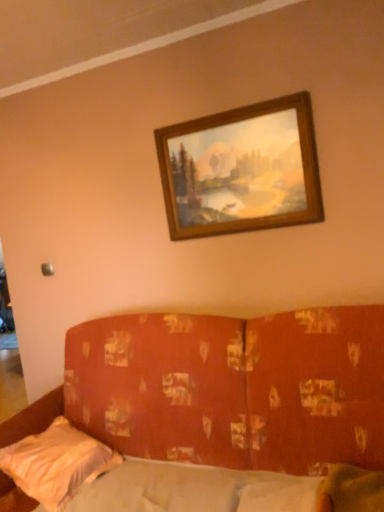
Describe the element at coordinates (56, 463) in the screenshot. I see `white satin pillow at lower left` at that location.

I want to click on white fabric mattress at lower center, so click(194, 490).

Where is `wooden frame at upper center`? wooden frame at upper center is located at coordinates (241, 169).

Locate an element on the screen. The width and height of the screenshot is (384, 512). white satin pillow at lower left is located at coordinates (56, 463).

You are a GUI agent. You are given a task and a screenshot of the screen. Output one action in this format:
    pyautogui.click(x=<x>, y=<y>)
    Task: Click on the studio couch above the white fabric mattress at lower center (from a real-world perspective)
    
    Given the screenshot: What is the action you would take?
    pyautogui.click(x=227, y=388)

Which object is thinner, white fabric mattress at lower center or textured orange fabric couch at center?

white fabric mattress at lower center.

Between white fabric mattress at lower center and textured orange fabric couch at center, which one has more height?

With more height is textured orange fabric couch at center.

Is white fabric mattress at lower center turned away from textured orange fabric couch at center?

Yes, white fabric mattress at lower center is positioned with its back facing textured orange fabric couch at center.

Based on their positions, is white fabric mattress at lower center located to the left or right of white satin pillow at lower left?

Based on their positions, white fabric mattress at lower center is located to the right of white satin pillow at lower left.

Which of these two, white fabric mattress at lower center or white satin pillow at lower left, stands shorter?

With less height is white fabric mattress at lower center.

How many degrees apart are the facing directions of white fabric mattress at lower center and white satin pillow at lower left?

There is a 5.73-degree angle between the facing directions of white fabric mattress at lower center and white satin pillow at lower left.

The width and height of the screenshot is (384, 512). I want to click on mattress on the right of white satin pillow at lower left, so click(194, 490).

Based on the photo, how many degrees apart are the facing directions of textured orange fabric couch at center and white fabric mattress at lower center?

textured orange fabric couch at center and white fabric mattress at lower center are facing 1.5 degrees away from each other.

Considering the sizes of objects textured orange fabric couch at center and white fabric mattress at lower center in the image provided, who is thinner, textured orange fabric couch at center or white fabric mattress at lower center?

Thinner between the two is white fabric mattress at lower center.

From the picture: Is textured orange fabric couch at center looking in the opposite direction of white fabric mattress at lower center?

Yes.

From the image's perspective, is textured orange fabric couch at center above or below white fabric mattress at lower center?

textured orange fabric couch at center is above white fabric mattress at lower center.

Which is in front, white satin pillow at lower left or textured orange fabric couch at center?

textured orange fabric couch at center.

Is white satin pillow at lower left not near textured orange fabric couch at center?

white satin pillow at lower left is actually quite close to textured orange fabric couch at center.

In the scene shown: Is white satin pillow at lower left oriented towards textured orange fabric couch at center?

Yes, white satin pillow at lower left is oriented towards textured orange fabric couch at center.

Looking at this image, who is smaller, textured orange fabric couch at center or wooden frame at upper center?

wooden frame at upper center.

Can you tell me how much textured orange fabric couch at center and wooden frame at upper center differ in facing direction?

0.00137 degrees.

Looking at this image, in the image, is textured orange fabric couch at center on the left side or the right side of wooden frame at upper center?

textured orange fabric couch at center is to the left of wooden frame at upper center.

Between textured orange fabric couch at center and wooden frame at upper center, which one has smaller width?

With smaller width is wooden frame at upper center.

Is wooden frame at upper center positioned beyond the bounds of white satin pillow at lower left?

wooden frame at upper center lies outside white satin pillow at lower left's area.

Identify the location of picture frame behind the white satin pillow at lower left. Image resolution: width=384 pixels, height=512 pixels. (241, 169).

Does wooden frame at upper center have a lesser height compared to white satin pillow at lower left?

No, wooden frame at upper center is not shorter than white satin pillow at lower left.

Looking at this image, is wooden frame at upper center smaller than white satin pillow at lower left?

Yes.

The width and height of the screenshot is (384, 512). I want to click on picture frame positioned vertically above the white fabric mattress at lower center (from a real-world perspective), so click(241, 169).

From the image's perspective, which one is positioned lower, white fabric mattress at lower center or wooden frame at upper center?

From the image's view, white fabric mattress at lower center is below.

Considering the relative sizes of white fabric mattress at lower center and wooden frame at upper center in the image provided, is white fabric mattress at lower center wider than wooden frame at upper center?

Yes, white fabric mattress at lower center is wider than wooden frame at upper center.

At what (x,y) coordinates should I click in order to perform the action: click on mattress below the textured orange fabric couch at center (from a real-world perspective). Please return your answer as a coordinate pair (x, y). Image resolution: width=384 pixels, height=512 pixels. Looking at the image, I should click on (194, 490).

Find the location of a particular element. This screenshot has height=512, width=384. mattress that is in front of the white satin pillow at lower left is located at coordinates (194, 490).

Which object lies further to the anchor point white fabric mattress at lower center, white satin pillow at lower left or textured orange fabric couch at center?

textured orange fabric couch at center is further to white fabric mattress at lower center.

Looking at the image, which one is located closer to white fabric mattress at lower center, wooden frame at upper center or textured orange fabric couch at center?

Based on the image, textured orange fabric couch at center appears to be nearer to white fabric mattress at lower center.

When comparing their distances from white fabric mattress at lower center, does wooden frame at upper center or white satin pillow at lower left seem further?

wooden frame at upper center is further to white fabric mattress at lower center.

Which object lies nearer to the anchor point textured orange fabric couch at center, wooden frame at upper center or white satin pillow at lower left?

white satin pillow at lower left lies closer to textured orange fabric couch at center than the other object.

Estimate the real-world distances between objects in this image. Which object is closer to white satin pillow at lower left, textured orange fabric couch at center or wooden frame at upper center?

textured orange fabric couch at center is closer to white satin pillow at lower left.

Estimate the real-world distances between objects in this image. Which object is further from white satin pillow at lower left, white fabric mattress at lower center or textured orange fabric couch at center?

textured orange fabric couch at center.

Which object lies further to the anchor point wooden frame at upper center, white fabric mattress at lower center or white satin pillow at lower left?

The object further to wooden frame at upper center is white satin pillow at lower left.

Which object lies nearer to the anchor point wooden frame at upper center, white satin pillow at lower left or textured orange fabric couch at center?

The object closer to wooden frame at upper center is textured orange fabric couch at center.

Where is `pillow between wooden frame at upper center and white fabric mattress at lower center in the vertical direction`? The width and height of the screenshot is (384, 512). pillow between wooden frame at upper center and white fabric mattress at lower center in the vertical direction is located at coordinates (56, 463).

Identify the location of studio couch that lies between wooden frame at upper center and white fabric mattress at lower center from top to bottom. (227, 388).

This screenshot has width=384, height=512. Identify the location of mattress positioned between textured orange fabric couch at center and white satin pillow at lower left from near to far. (194, 490).

Image resolution: width=384 pixels, height=512 pixels. I want to click on studio couch between wooden frame at upper center and white satin pillow at lower left in the vertical direction, so click(x=227, y=388).